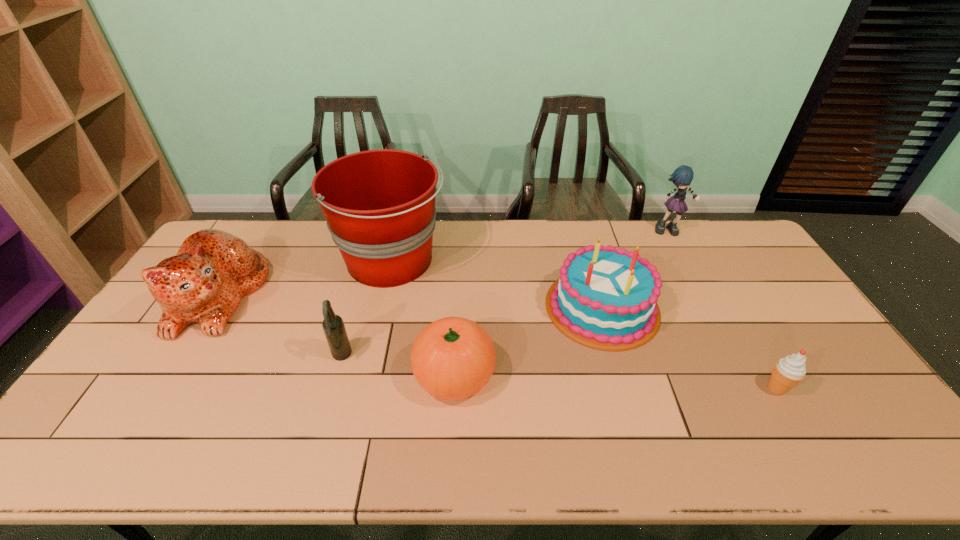
At what (x,y) coordinates should I click in order to perform the action: click on empty location between the beer bottle and the shortest object. Please return your answer as a coordinate pair (x, y). The height and width of the screenshot is (540, 960). Looking at the image, I should click on (559, 373).

You are a GUI agent. You are given a task and a screenshot of the screen. Output one action in this format:
    pyautogui.click(x=<x>, y=<y>)
    Task: Click on the vacant space that's between the birthday cake and the pumpkin
    
    Given the screenshot: What is the action you would take?
    pyautogui.click(x=528, y=341)

Where is `vacant point located between the beer bottle and the pumpkin`? vacant point located between the beer bottle and the pumpkin is located at coordinates (397, 365).

This screenshot has width=960, height=540. What are the coordinates of `free spot between the shortest object and the fifth object from left to right` in the screenshot? It's located at (689, 348).

Locate which object is the second closest to the rag doll. Please provide its 2D coordinates. Your answer should be formatted as a tuple, i.e. [(x, y)], where the tuple contains the x and y coordinates of a point satisfying the conditions above.

[(789, 371)]

Identify the location of object that is the fourth closest to the tallest object. (604, 297).

The height and width of the screenshot is (540, 960). I want to click on vacant area in the image that satisfies the following two spatial constraints: 1. on the face of the cat; 2. on the left side of the icecream, so click(x=161, y=388).

Find the location of a particular element. This screenshot has height=540, width=960. blank area in the image that satisfies the following two spatial constraints: 1. on the front side of the bucket; 2. on the left side of the pumpkin is located at coordinates (366, 374).

Image resolution: width=960 pixels, height=540 pixels. In order to click on vacant region that satisfies the following two spatial constraints: 1. on the back side of the birthday cake; 2. on the left side of the beer bottle in this screenshot , I will do `click(356, 307)`.

Locate an element on the screen. The image size is (960, 540). blank area in the image that satisfies the following two spatial constraints: 1. on the back side of the pumpkin; 2. on the face of the leftmost object is located at coordinates click(459, 296).